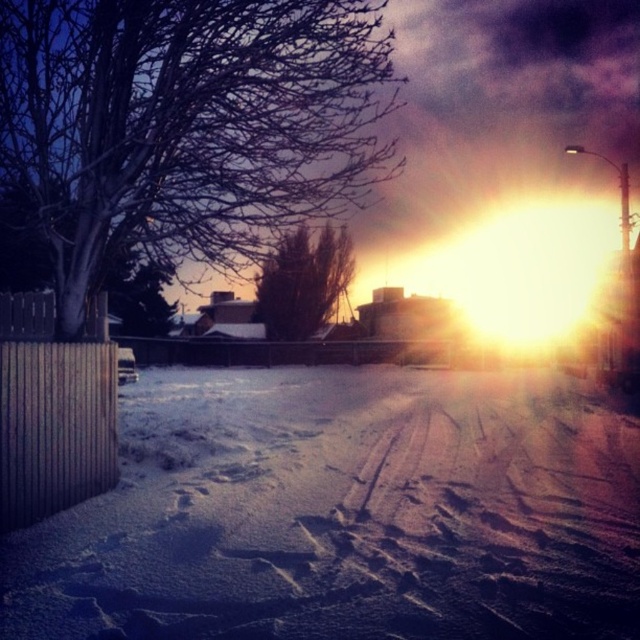
You are an artist planning to paint the winter sunset scene. You want to ensure the proportions between the bare wood tree at upper left and the brown textured bush at center are accurate. Which object should you paint larger?

The bare wood tree at upper left should be painted larger because it is larger in size than the brown textured bush at center according to the description.

You are a hiker who wants to walk from the wooden fence on the left to the path on the right. There is white powdery snow at center and a brown textured bush at center in your way. Which object will you have to step over or around first?

The brown textured bush at center is smaller in width than the white powdery snow at center, so you would encounter the brown textured bush at center first since it is narrower and likely positioned closer to your path.